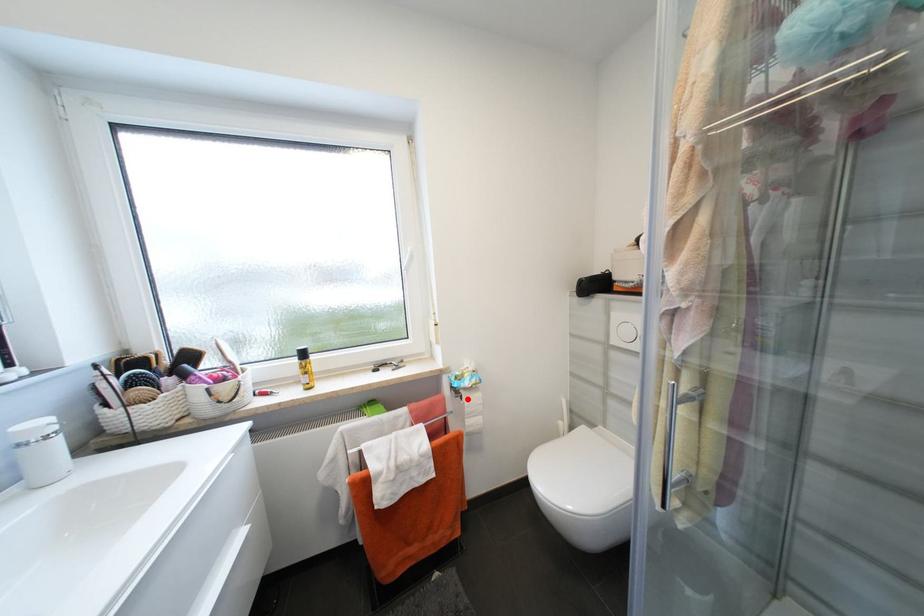
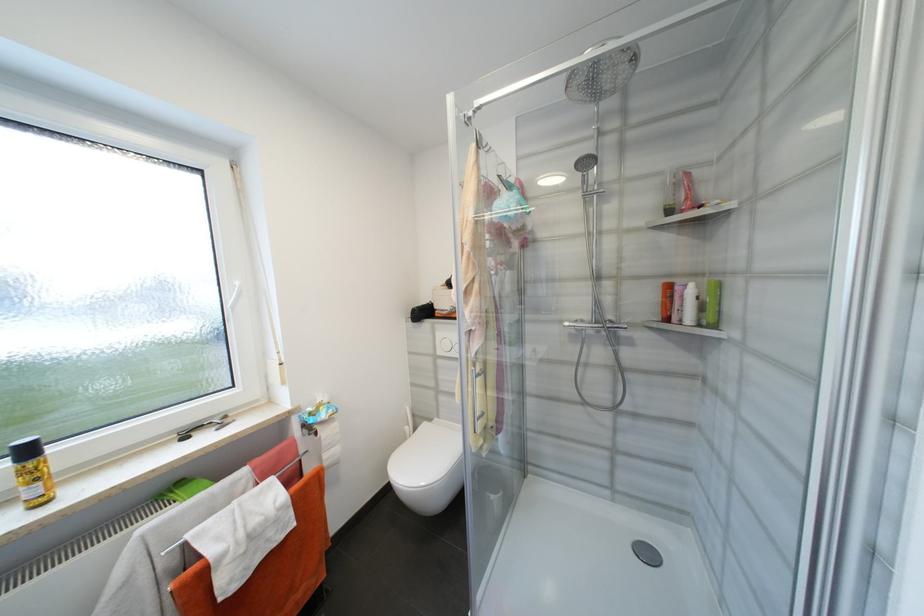
Question: I am providing you with two images of the same scene from different viewpoints. In image1, a red point is highlighted. Considering the same 3D point in image2, which of the following is correct?

Choices:
 (A) It is closer
 (B) It is farther

Answer: (A)